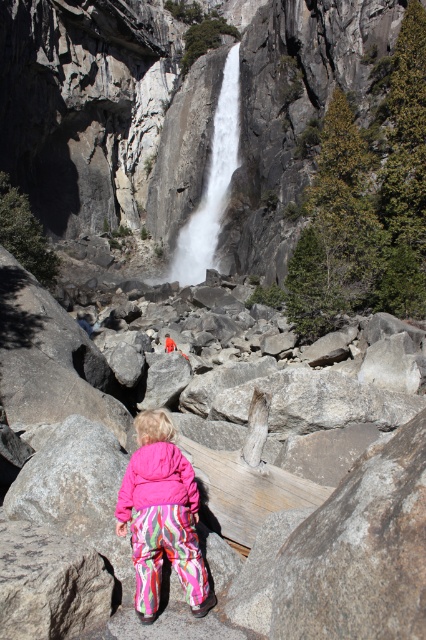
Who is shorter, pink fleece jacket at center or white smooth waterfall at center?

pink fleece jacket at center

This screenshot has height=640, width=426. Find the location of `pink fleece jacket at center`. pink fleece jacket at center is located at coordinates (161, 516).